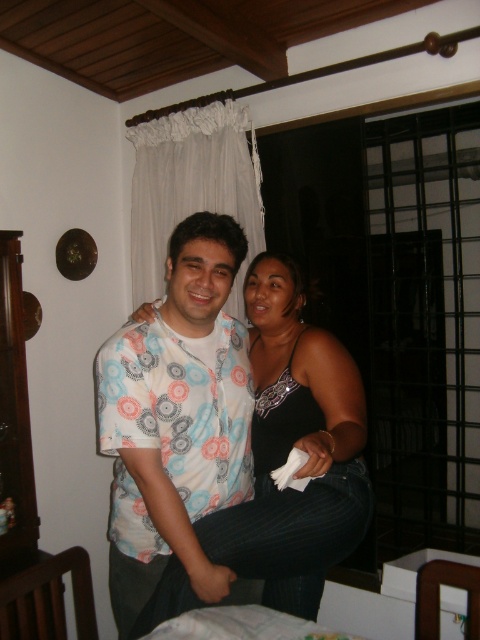
You are a photographer adjusting the framing for a portrait. The subjects are wearing a white printed shirt at center and a black satin tank top at center. Which clothing item should you focus on to ensure it fits within the frame without cropping, considering their sizes?

The black satin tank top at center should be focused on since its width is smaller than the white printed shirt at center, making it easier to fit within the frame without cropping.

What object is located at the point with coordinates (177, 419) in the scene?

The point at coordinates (177, 419) indicates the white printed shirt at center.

You are a photographer trying to capture a closeup of the white printed shirt at center and the black satin tank top at center. Which one should you focus on first if you want to ensure both are in focus?

The white printed shirt at center is below the black satin tank top at center, so you should focus on the black satin tank top at center first to ensure both are in focus.